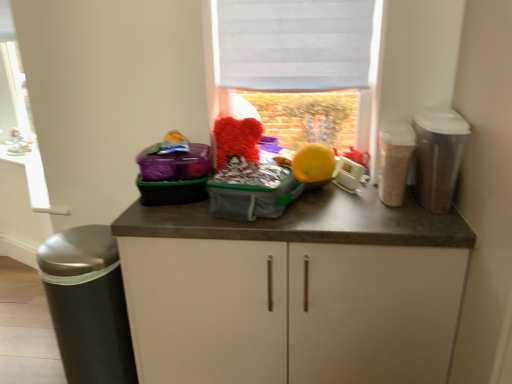
Question: Is white fabric at upper center not inside white plastic window frame at left?

Choices:
 (A) no
 (B) yes

Answer: (B)

Question: From a real-world perspective, is white fabric at upper center under white plastic window frame at left?

Choices:
 (A) yes
 (B) no

Answer: (B)

Question: Is white fabric at upper center wider than white plastic window frame at left?

Choices:
 (A) yes
 (B) no

Answer: (B)

Question: Does white fabric at upper center appear on the left side of white plastic window frame at left?

Choices:
 (A) yes
 (B) no

Answer: (B)

Question: Would you consider white fabric at upper center to be distant from white plastic window frame at left?

Choices:
 (A) yes
 (B) no

Answer: (A)

Question: From the image's perspective, is white fabric at upper center on top of white plastic window frame at left?

Choices:
 (A) no
 (B) yes

Answer: (A)

Question: From a real-world perspective, is translucent plastic canister at right, the first appliance when ordered from right to left, positioned under white matte cabinet at center based on gravity?

Choices:
 (A) no
 (B) yes

Answer: (A)

Question: From a real-world perspective, is translucent plastic canister at right, the third appliance in the left-to-right sequence, located higher than white matte cabinet at center?

Choices:
 (A) yes
 (B) no

Answer: (A)

Question: Is translucent plastic canister at right, the third appliance in the left-to-right sequence, aimed at white matte cabinet at center?

Choices:
 (A) no
 (B) yes

Answer: (A)

Question: Is translucent plastic canister at right, the first appliance when ordered from right to left, outside of white matte cabinet at center?

Choices:
 (A) no
 (B) yes

Answer: (B)

Question: Is translucent plastic canister at right, the first appliance when ordered from right to left, positioned in front of white matte cabinet at center?

Choices:
 (A) yes
 (B) no

Answer: (B)

Question: Considering the relative sizes of translucent plastic canister at right, the third appliance in the left-to-right sequence, and white matte cabinet at center in the image provided, is translucent plastic canister at right, the third appliance in the left-to-right sequence, taller than white matte cabinet at center?

Choices:
 (A) no
 (B) yes

Answer: (A)

Question: Is the depth of white fabric at upper center less than that of translucent plastic canister at right, the first appliance when ordered from right to left?

Choices:
 (A) no
 (B) yes

Answer: (A)